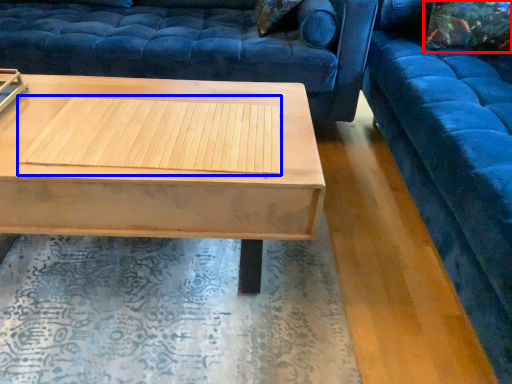
Question: Which of the following is the closest to the observer, pillow (highlighted by a red box) or wood (highlighted by a blue box)?

Choices:
 (A) pillow
 (B) wood

Answer: (B)